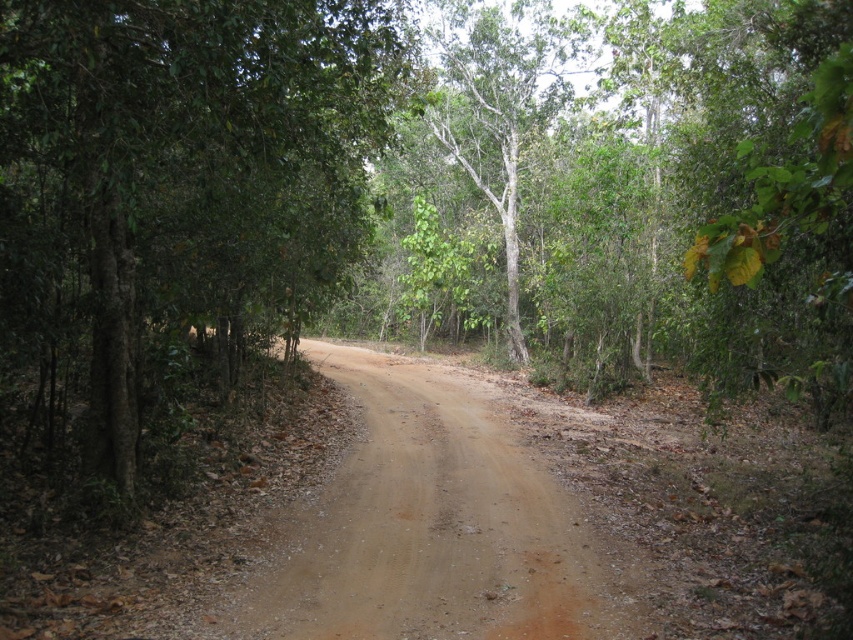
Does point (231, 168) lie in front of point (508, 10)?

That is True.

Is point (299, 310) positioned before point (532, 76)?

That is True.

I want to click on green leafy tree at left, so click(x=171, y=202).

Does brown dirt track at center have a lesser width compared to green matte tree at center?

Correct, brown dirt track at center's width is less than green matte tree at center's.

From the picture: Can you confirm if brown dirt track at center is wider than green matte tree at center?

No.

Find the location of a particular element. brown dirt track at center is located at coordinates (432, 529).

The image size is (853, 640). What do you see at coordinates (171, 202) in the screenshot? I see `green leafy tree at left` at bounding box center [171, 202].

Who is more distant from viewer, (51, 340) or (468, 493)?

Positioned behind is point (468, 493).

Image resolution: width=853 pixels, height=640 pixels. Identify the location of green leafy tree at left. coord(171,202).